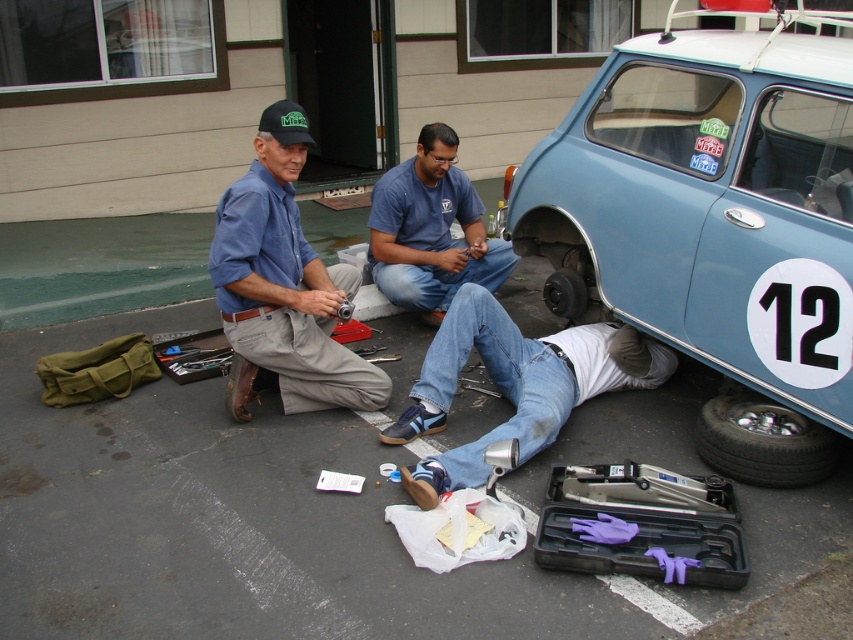
Question: Which point appears farthest from the camera in this image?

Choices:
 (A) (573, 292)
 (B) (280, 285)

Answer: (A)

Question: Which object appears farthest from the camera in this image?

Choices:
 (A) blue denim jeans at center
 (B) black rubber tire at lower right
 (C) black rubber tire at lower center
 (D) purple rubber gloves at lower center

Answer: (A)

Question: Does blue jeans at lower center appear under purple rubber gloves at lower center?

Choices:
 (A) yes
 (B) no

Answer: (B)

Question: Which point is farther to the camera?

Choices:
 (A) blue denim jeans at center
 (B) light blue metallic car at lower right
 (C) blue denim shirt at center
 (D) blue jeans at lower center

Answer: (A)

Question: Is blue jeans at lower center above purple rubber gloves at lower center?

Choices:
 (A) no
 (B) yes

Answer: (B)

Question: Can you confirm if blue denim shirt at center is bigger than blue jeans at lower center?

Choices:
 (A) no
 (B) yes

Answer: (A)